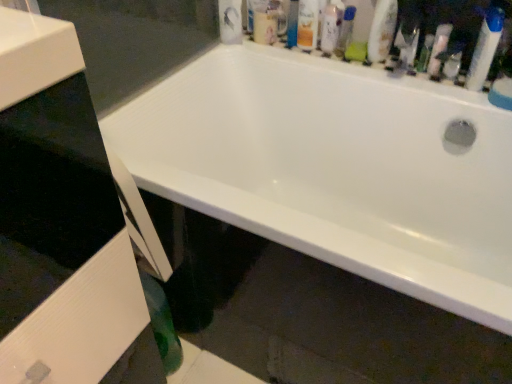
What do you see at coordinates (485, 47) in the screenshot? I see `blue plastic toothbrush at upper right, arranged as the first toiletry when viewed from the right` at bounding box center [485, 47].

Measure the distance between blue plastic toothbrush at upper right, the fourth toiletry viewed from the left, and camera.

blue plastic toothbrush at upper right, the fourth toiletry viewed from the left, is 1.04 meters from camera.

Find the location of `white plastic mouthwash at upper center, which is counted as the 3th mouthwash, starting from the right`. white plastic mouthwash at upper center, which is counted as the 3th mouthwash, starting from the right is located at coordinates (265, 21).

Find the location of a particular element. white glossy lotion at upper center, which ranks as the third toiletry in right-to-left order is located at coordinates (331, 26).

Between matte orange can at upper center, the 4th toiletry viewed from the right, and translucent plastic mouthwash at upper center, the second mouthwash viewed from the right, which one has larger width?

Wider between the two is matte orange can at upper center, the 4th toiletry viewed from the right.

In the scene shown: Is matte orange can at upper center, which ranks as the first toiletry in left-to-right order, bigger than translucent plastic mouthwash at upper center, the second mouthwash viewed from the right?

Indeed, matte orange can at upper center, which ranks as the first toiletry in left-to-right order, has a larger size compared to translucent plastic mouthwash at upper center, the second mouthwash viewed from the right.

Does matte orange can at upper center, which ranks as the first toiletry in left-to-right order, come behind translucent plastic mouthwash at upper center, the 2th mouthwash from the left?

No, it is in front of translucent plastic mouthwash at upper center, the 2th mouthwash from the left.

What's the angular difference between matte orange can at upper center, the 4th toiletry viewed from the right, and translucent plastic mouthwash at upper center, the second mouthwash viewed from the right,'s facing directions?

They differ by 0.000549 degrees in their facing directions.

Is green plastic tube at upper right, which is counted as the 2th toiletry, starting from the right, shorter than white glossy bathtub at upper center?

Yes.

Choose the correct answer: Is green plastic tube at upper right, the third toiletry in the left-to-right sequence, inside white glossy bathtub at upper center or outside it?

green plastic tube at upper right, the third toiletry in the left-to-right sequence, is located beyond the bounds of white glossy bathtub at upper center.

Is green plastic tube at upper right, which is counted as the 2th toiletry, starting from the right, facing away from white glossy bathtub at upper center?

No.

From the image's perspective, which object appears higher, white glossy bottle at upper right, the 1th cleaning product from the left, or green plastic mouthwash at upper center, which is counted as the third mouthwash, starting from the left?

green plastic mouthwash at upper center, which is counted as the third mouthwash, starting from the left, from the image's perspective.

Is white glossy bottle at upper right, the 1th cleaning product from the left, shorter than green plastic mouthwash at upper center, the 1th mouthwash from the right?

No.

Looking at their sizes, would you say white glossy bottle at upper right, the 1th cleaning product from the left, is wider or thinner than green plastic mouthwash at upper center, the 1th mouthwash from the right?

Clearly, white glossy bottle at upper right, the 1th cleaning product from the left, has less width compared to green plastic mouthwash at upper center, the 1th mouthwash from the right.

Consider the image. Considering the relative sizes of white glossy bottle at upper right, the 1th cleaning product from the left, and green plastic mouthwash at upper center, the 1th mouthwash from the right, in the image provided, is white glossy bottle at upper right, the 1th cleaning product from the left, smaller than green plastic mouthwash at upper center, the 1th mouthwash from the right,?

No, white glossy bottle at upper right, the 1th cleaning product from the left, is not smaller than green plastic mouthwash at upper center, the 1th mouthwash from the right.

In the image, is translucent plastic spray bottle at upper right, which appears as the 2th cleaning product when viewed from the left, on the left side or the right side of translucent plastic mouthwash at upper center, the second mouthwash viewed from the right?

From the image, it's evident that translucent plastic spray bottle at upper right, which appears as the 2th cleaning product when viewed from the left, is to the right of translucent plastic mouthwash at upper center, the second mouthwash viewed from the right.

Which of these two, translucent plastic spray bottle at upper right, which is counted as the 1th cleaning product, starting from the right, or translucent plastic mouthwash at upper center, the 2th mouthwash from the left, stands shorter?

Standing shorter between the two is translucent plastic spray bottle at upper right, which is counted as the 1th cleaning product, starting from the right.

Considering the relative positions of white glossy lotion at upper center, marked as the 2th toiletry in a left-to-right arrangement, and translucent plastic spray bottle at upper right, which appears as the 2th cleaning product when viewed from the left, in the image provided, is white glossy lotion at upper center, marked as the 2th toiletry in a left-to-right arrangement, in front of translucent plastic spray bottle at upper right, which appears as the 2th cleaning product when viewed from the left,?

No, it is behind translucent plastic spray bottle at upper right, which appears as the 2th cleaning product when viewed from the left.

Does point (326, 55) appear closer or farther from the camera than point (440, 42)?

Point (326, 55) is positioned farther from the camera compared to point (440, 42).

Which of these two, white glossy lotion at upper center, marked as the 2th toiletry in a left-to-right arrangement, or translucent plastic spray bottle at upper right, which appears as the 2th cleaning product when viewed from the left, stands shorter?

translucent plastic spray bottle at upper right, which appears as the 2th cleaning product when viewed from the left, is shorter.

From the image's perspective, is white glossy lotion at upper center, which ranks as the third toiletry in right-to-left order, located above or below translucent plastic spray bottle at upper right, which appears as the 2th cleaning product when viewed from the left?

Based on their image positions, white glossy lotion at upper center, which ranks as the third toiletry in right-to-left order, is located above translucent plastic spray bottle at upper right, which appears as the 2th cleaning product when viewed from the left.

Would you consider white glossy bathtub at upper center to be distant from blue plastic toothbrush at upper right, arranged as the first toiletry when viewed from the right?

No, white glossy bathtub at upper center is in close proximity to blue plastic toothbrush at upper right, arranged as the first toiletry when viewed from the right.

From the image's perspective, which is above, white glossy bathtub at upper center or blue plastic toothbrush at upper right, arranged as the first toiletry when viewed from the right?

From the image's view, blue plastic toothbrush at upper right, arranged as the first toiletry when viewed from the right, is above.

Between white glossy bathtub at upper center and blue plastic toothbrush at upper right, the fourth toiletry viewed from the left, which one appears on the right side from the viewer's perspective?

Positioned to the right is blue plastic toothbrush at upper right, the fourth toiletry viewed from the left.

From a real-world perspective, which object stands above the other?

blue plastic toothbrush at upper right, the fourth toiletry viewed from the left, is physically above.

Considering the relative sizes of green plastic mouthwash at upper center, the 1th mouthwash from the right, and white glossy bottle at upper right, the 1th cleaning product from the left, in the image provided, is green plastic mouthwash at upper center, the 1th mouthwash from the right, taller than white glossy bottle at upper right, the 1th cleaning product from the left,?

No, green plastic mouthwash at upper center, the 1th mouthwash from the right, is not taller than white glossy bottle at upper right, the 1th cleaning product from the left.

Is white glossy bottle at upper right, positioned as the second cleaning product in right-to-left order, at the back of green plastic mouthwash at upper center, which is counted as the third mouthwash, starting from the left?

No, white glossy bottle at upper right, positioned as the second cleaning product in right-to-left order, is not at the back of green plastic mouthwash at upper center, which is counted as the third mouthwash, starting from the left.

Considering the sizes of objects green plastic mouthwash at upper center, which is counted as the third mouthwash, starting from the left, and white glossy bottle at upper right, the 1th cleaning product from the left, in the image provided, who is bigger, green plastic mouthwash at upper center, which is counted as the third mouthwash, starting from the left, or white glossy bottle at upper right, the 1th cleaning product from the left,?

Bigger between the two is white glossy bottle at upper right, the 1th cleaning product from the left.

Starting from the translucent plastic mouthwash at upper center, the 2th mouthwash from the left, which toiletry is the 1st one in front? Please provide its 2D coordinates.

[(307, 24)]

I want to click on bathtub beneath the green plastic tube at upper right, the third toiletry in the left-to-right sequence (from a real-world perspective), so tap(337, 168).

Which object lies further to the anchor point white glossy lotion at upper center, marked as the 2th toiletry in a left-to-right arrangement, white glossy bathtub at upper center or matte orange can at upper center, which ranks as the first toiletry in left-to-right order?

white glossy bathtub at upper center lies further to white glossy lotion at upper center, marked as the 2th toiletry in a left-to-right arrangement, than the other object.

Based on their spatial positions, is white glossy bottle at upper right, positioned as the second cleaning product in right-to-left order, or green plastic mouthwash at upper center, which is counted as the third mouthwash, starting from the left, closer to translucent plastic spray bottle at upper right, which appears as the 2th cleaning product when viewed from the left?

Based on the image, white glossy bottle at upper right, positioned as the second cleaning product in right-to-left order, appears to be nearer to translucent plastic spray bottle at upper right, which appears as the 2th cleaning product when viewed from the left.

Which object lies nearer to the anchor point white plastic mouthwash at upper center, which appears as the first mouthwash when viewed from the left, green plastic mouthwash at upper center, the 1th mouthwash from the right, or white glossy bottle at upper right, the 1th cleaning product from the left?

green plastic mouthwash at upper center, the 1th mouthwash from the right, is positioned closer to the anchor white plastic mouthwash at upper center, which appears as the first mouthwash when viewed from the left.

Estimate the real-world distances between objects in this image. Which object is closer to white glossy bathtub at upper center, white plastic mouthwash at upper center, which is counted as the 3th mouthwash, starting from the right, or matte orange can at upper center, which ranks as the first toiletry in left-to-right order?

matte orange can at upper center, which ranks as the first toiletry in left-to-right order.

Estimate the real-world distances between objects in this image. Which object is further from white plastic mouthwash at upper center, which is counted as the 3th mouthwash, starting from the right, white glossy lotion at upper center, which ranks as the third toiletry in right-to-left order, or translucent plastic mouthwash at upper center, the 2th mouthwash from the left?

white glossy lotion at upper center, which ranks as the third toiletry in right-to-left order, is positioned further to the anchor white plastic mouthwash at upper center, which is counted as the 3th mouthwash, starting from the right.

Based on their spatial positions, is blue plastic toothbrush at upper right, the fourth toiletry viewed from the left, or white glossy bathtub at upper center closer to green plastic mouthwash at upper center, the 1th mouthwash from the right?

blue plastic toothbrush at upper right, the fourth toiletry viewed from the left.

Looking at the image, which one is located further to green plastic tube at upper right, which is counted as the 2th toiletry, starting from the right, translucent plastic mouthwash at upper center, the 2th mouthwash from the left, or white glossy lotion at upper center, marked as the 2th toiletry in a left-to-right arrangement?

translucent plastic mouthwash at upper center, the 2th mouthwash from the left, is further to green plastic tube at upper right, which is counted as the 2th toiletry, starting from the right.

From the picture: From the image, which object appears to be nearer to matte orange can at upper center, the 4th toiletry viewed from the right, translucent plastic spray bottle at upper right, which appears as the 2th cleaning product when viewed from the left, or translucent plastic mouthwash at upper center, the 2th mouthwash from the left?

translucent plastic mouthwash at upper center, the 2th mouthwash from the left.

At what (x,y) coordinates should I click in order to perform the action: click on mouthwash located between matte orange can at upper center, which ranks as the first toiletry in left-to-right order, and translucent plastic spray bottle at upper right, which appears as the 2th cleaning product when viewed from the left, in the left-right direction. Please return your answer as a coordinate pair (x, y). Looking at the image, I should click on (345, 30).

Where is `mouthwash located between matte orange can at upper center, the 4th toiletry viewed from the right, and green plastic tube at upper right, the third toiletry in the left-to-right sequence, in the left-right direction`? The width and height of the screenshot is (512, 384). mouthwash located between matte orange can at upper center, the 4th toiletry viewed from the right, and green plastic tube at upper right, the third toiletry in the left-to-right sequence, in the left-right direction is located at coordinates (345, 30).

The image size is (512, 384). I want to click on cleaning product between white glossy bottle at upper right, the 1th cleaning product from the left, and blue plastic toothbrush at upper right, arranged as the first toiletry when viewed from the right, from left to right, so click(x=438, y=50).

Image resolution: width=512 pixels, height=384 pixels. What are the coordinates of `cleaning product between matte orange can at upper center, the 4th toiletry viewed from the right, and translucent plastic spray bottle at upper right, which is counted as the 1th cleaning product, starting from the right` in the screenshot? It's located at (382, 30).